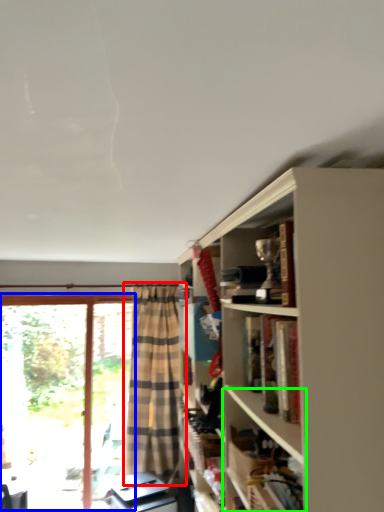
Question: Estimate the real-world distances between objects in this image. Which object is closer to curtain (highlighted by a red box), bay window (highlighted by a blue box) or shelf (highlighted by a green box)?

Choices:
 (A) bay window
 (B) shelf

Answer: (A)